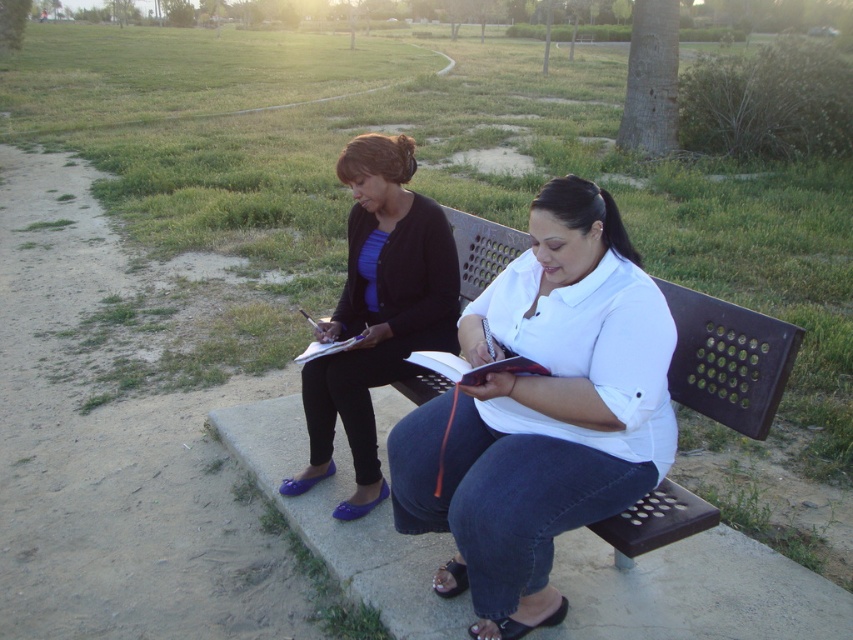
Question: Is white matte shirt at center bigger than matte black sweater at upper left?

Choices:
 (A) yes
 (B) no

Answer: (A)

Question: Does white matte shirt at center have a lesser width compared to red leather journal at center?

Choices:
 (A) no
 (B) yes

Answer: (A)

Question: Is matte black sweater at upper left above red leather journal at center?

Choices:
 (A) yes
 (B) no

Answer: (A)

Question: Estimate the real-world distances between objects in this image. Which object is farther from the white matte shirt at center?

Choices:
 (A) matte black sweater at upper left
 (B) red leather journal at center

Answer: (A)

Question: Which point is closer to the camera?

Choices:
 (A) red leather journal at center
 (B) white matte shirt at center
 (C) matte black sweater at upper left

Answer: (B)

Question: Based on their relative distances, which object is nearer to the matte black sweater at upper left?

Choices:
 (A) red leather journal at center
 (B) white matte shirt at center

Answer: (A)